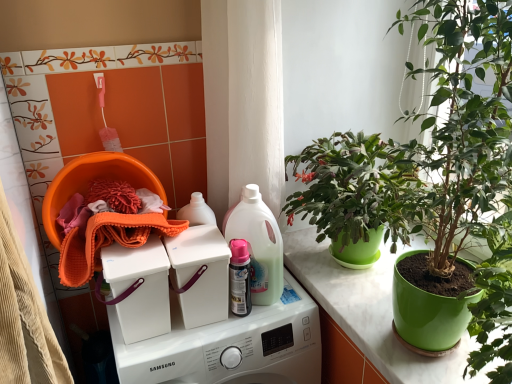
Question: Do you think white plastic washing machine at center, which ranks as the second washing machine in bottom-to-top order, is within translucent plastic spray bottle at center, or outside of it?

Choices:
 (A) inside
 (B) outside

Answer: (B)

Question: Is white plastic washing machine at center, which ranks as the second washing machine in bottom-to-top order, wider or thinner than translucent plastic spray bottle at center?

Choices:
 (A) wide
 (B) thin

Answer: (B)

Question: Based on their relative distances, which object is nearer to the white plastic washing machine at center, the first washing machine viewed from the top?

Choices:
 (A) orange microfiber cloth at left
 (B) green plastic pot at right
 (C) translucent plastic spray bottle at center
 (D) green matte plant at upper right
 (E) pink glossy spray can at center

Answer: (E)

Question: Considering the real-world distances, which object is closest to the translucent plastic spray bottle at center?

Choices:
 (A) green matte plant at upper right
 (B) pink glossy spray can at center
 (C) white plastic washing machine at center, which ranks as the first washing machine in bottom-to-top order
 (D) white plastic washing machine at center, the first washing machine viewed from the top
 (E) green matte plant pot at center

Answer: (B)